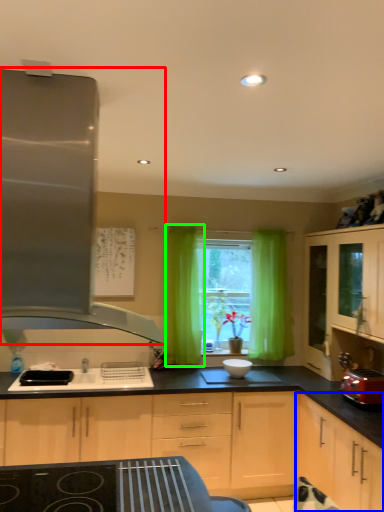
Question: Which object is positioned closest to kitchen appliance (highlighted by a red box)? Select from cabinetry (highlighted by a blue box) and curtain (highlighted by a green box).

Choices:
 (A) cabinetry
 (B) curtain

Answer: (A)